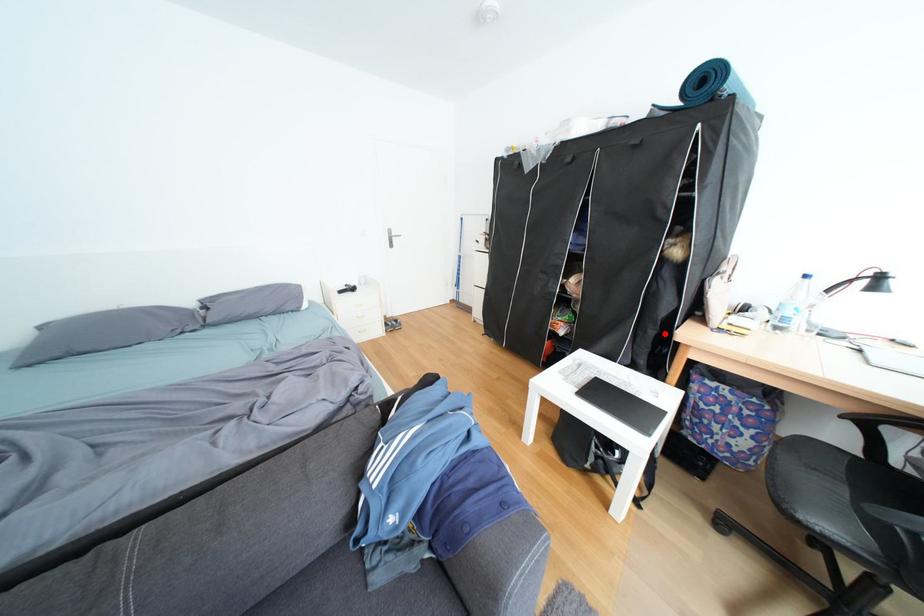
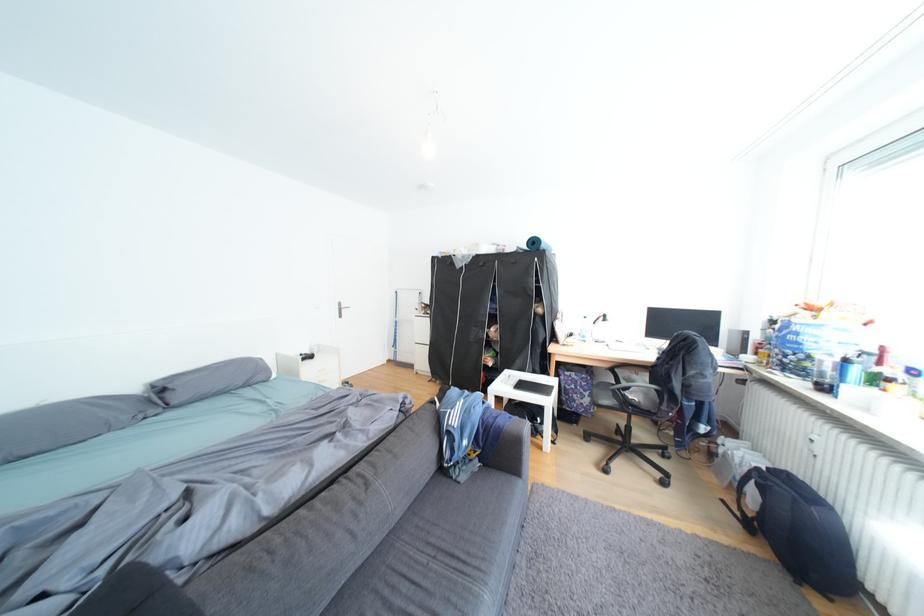
Question: I am providing you with two images of the same scene from different viewpoints. A red point is shown in image1. For the corresponding object point in image2, is it positioned nearer or farther from the camera?

Choices:
 (A) Nearer
 (B) Farther

Answer: (B)